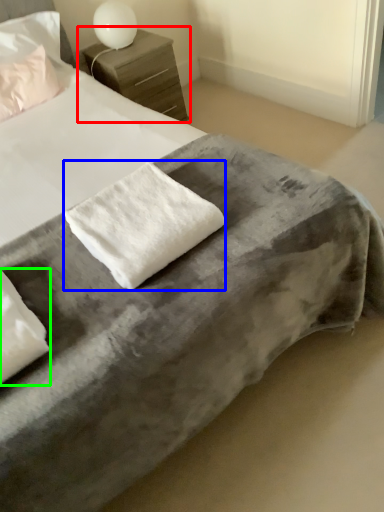
Question: Which object is positioned closest to nightstand (highlighted by a red box)? Select from cloth (highlighted by a blue box) and pillow (highlighted by a green box).

Choices:
 (A) cloth
 (B) pillow

Answer: (A)